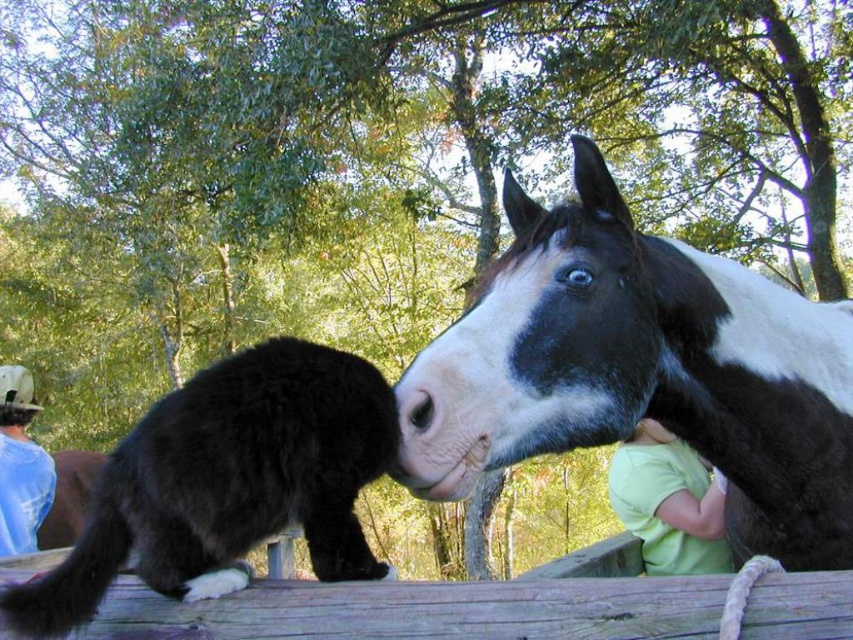
Can you confirm if black and white speckled horse at right is positioned to the left of blue denim shirt at upper left?

In fact, black and white speckled horse at right is to the right of blue denim shirt at upper left.

Looking at this image, is black and white speckled horse at right to the right of blue denim shirt at upper left from the viewer's perspective?

Yes, black and white speckled horse at right is to the right of blue denim shirt at upper left.

Where is `black and white speckled horse at right`? The height and width of the screenshot is (640, 853). black and white speckled horse at right is located at coordinates (641, 371).

Which of these two, fluffy black cat at left or light green fabric at lower right, stands taller?

With more height is light green fabric at lower right.

Is fluffy black cat at left positioned in front of light green fabric at lower right?

Yes.

Between point (334, 524) and point (634, 477), which one is positioned in front?

Point (334, 524) is more forward.

Identify the location of fluffy black cat at left. (228, 483).

Looking at this image, between light green fabric at lower right and blue denim shirt at upper left, which one is positioned higher?

light green fabric at lower right

Which is in front, point (656, 508) or point (0, 419)?

Point (656, 508) is in front.

You are a GUI agent. You are given a task and a screenshot of the screen. Output one action in this format:
    pyautogui.click(x=<x>, y=<y>)
    Task: Click on the light green fabric at lower right
    Image resolution: width=853 pixels, height=640 pixels.
    Given the screenshot: What is the action you would take?
    pyautogui.click(x=669, y=502)